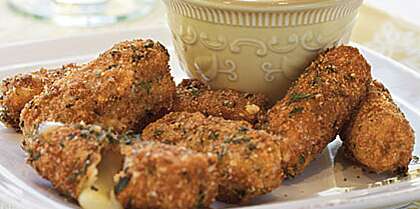
Locate an element on the screen. bowl is located at coordinates (254, 38).